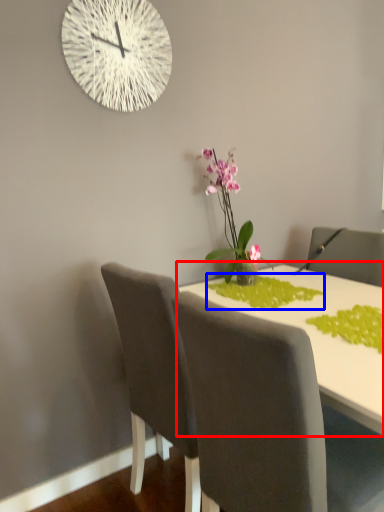
Question: Among these objects, which one is farthest to the camera, table (highlighted by a red box) or plant (highlighted by a blue box)?

Choices:
 (A) table
 (B) plant

Answer: (B)